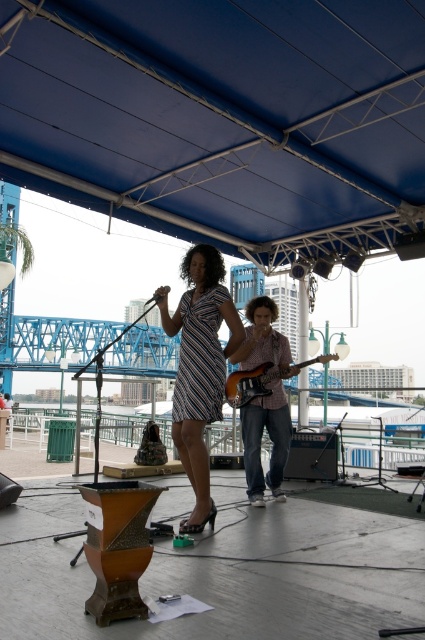
Based on the photo, you are a photographer at the back of the stage. You want to take a photo of both the striped fabric dress at center and the wooden electric guitar at center. Which object will appear closer to the camera in the photo?

The striped fabric dress at center will appear closer to the camera because it is positioned in front of the wooden electric guitar at center.

You are a stagehand trying to position two lights for the performers. The first light needs to be placed at point A at point [193,525] and the second at point B at point [328,358]. From the audience perspective, which light will be closer to the front of the stage?

Point A at point [193,525] is in front of point B at point [328,358], so the light at point A will be closer to the front of the stage from the audience perspective.

You are a photographer at the back of the stage. You want to take a photo of both the striped fabric dress at center and the wooden electric guitar at center. Which object should you zoom in on to capture more details without moving closer?

The striped fabric dress at center has a lesser width compared to the wooden electric guitar at center, so you should zoom in on the striped fabric dress at center to capture more details without moving closer.